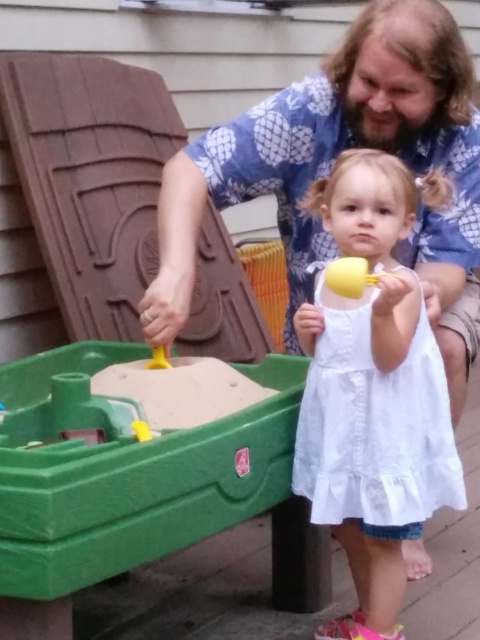
Between white lace dress at center and yellow plastic shovel at lower center, which one has less height?

yellow plastic shovel at lower center

In the scene shown: Is white lace dress at center positioned behind yellow plastic shovel at lower center?

No, it is in front of yellow plastic shovel at lower center.

What do you see at coordinates (374, 428) in the screenshot?
I see `white lace dress at center` at bounding box center [374, 428].

Find the location of a particular element. white lace dress at center is located at coordinates (374, 428).